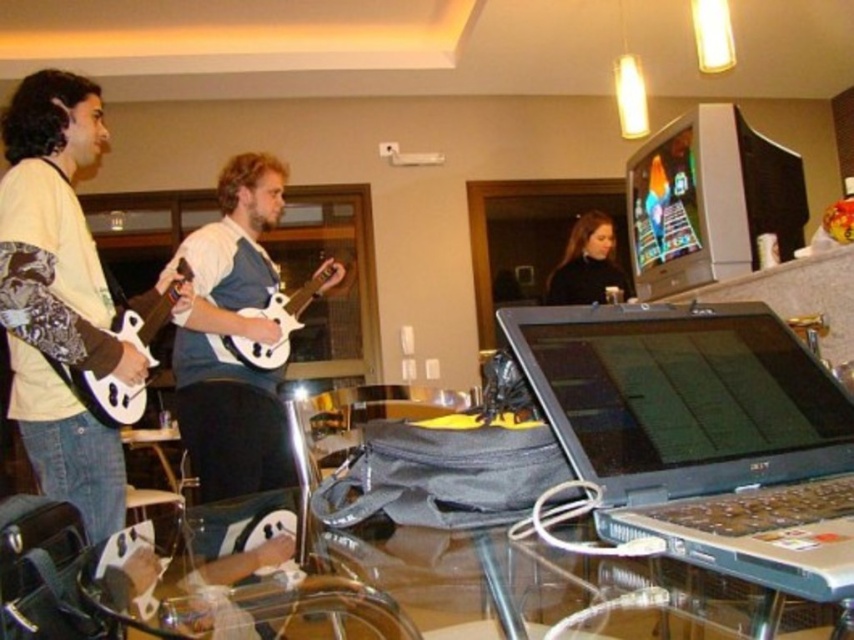
Question: Is silver metallic laptop at lower right above dark brown hair at center?

Choices:
 (A) yes
 (B) no

Answer: (B)

Question: Which of the following is the closest to the observer?

Choices:
 (A) dark brown hair at center
 (B) white glossy guitar at center
 (C) silver metallic laptop at lower right
 (D) white matte electric guitar at center

Answer: (C)

Question: Does silver metallic laptop at lower right have a greater width compared to dark brown hair at center?

Choices:
 (A) no
 (B) yes

Answer: (B)

Question: Considering the real-world distances, which object is closest to the dark brown hair at center?

Choices:
 (A) white matte electric guitar at left
 (B) white glossy guitar at center

Answer: (B)

Question: Considering the relative positions of white glossy guitar at center and dark brown hair at center in the image provided, where is white glossy guitar at center located with respect to dark brown hair at center?

Choices:
 (A) below
 (B) above

Answer: (A)

Question: Among these objects, which one is nearest to the camera?

Choices:
 (A) white glossy guitar at center
 (B) white matte electric guitar at left

Answer: (B)